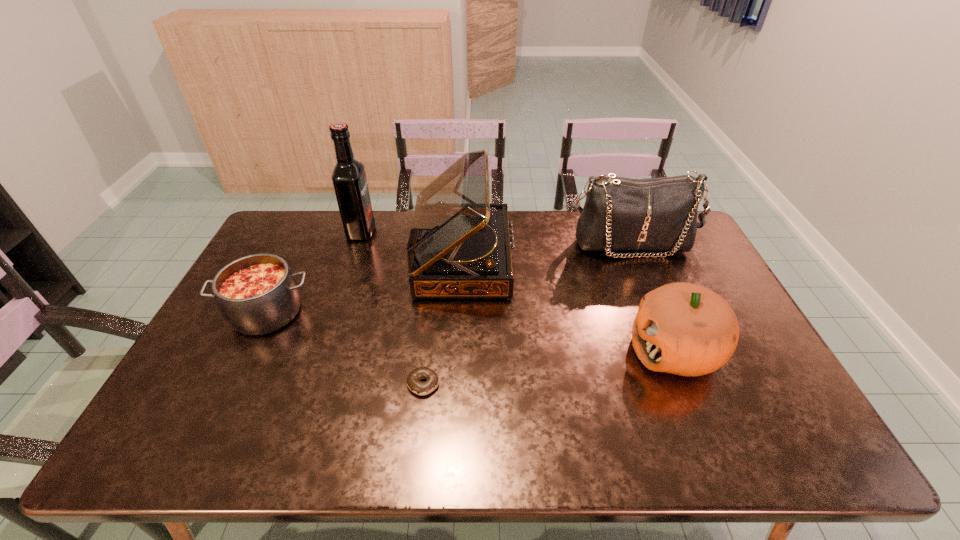
This screenshot has width=960, height=540. I want to click on vacant region that satisfies the following two spatial constraints: 1. on the front-facing side of the second object from left to right; 2. on the back side of the shortest object, so click(310, 384).